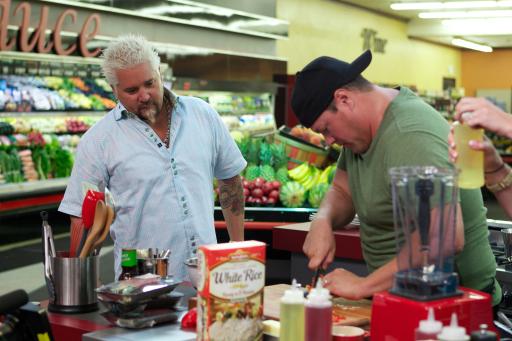
At what (x,y) coordinates should I click in order to perform the action: click on blender. Please return your answer as a coordinate pair (x, y). This screenshot has width=512, height=341. Looking at the image, I should click on 416,255.